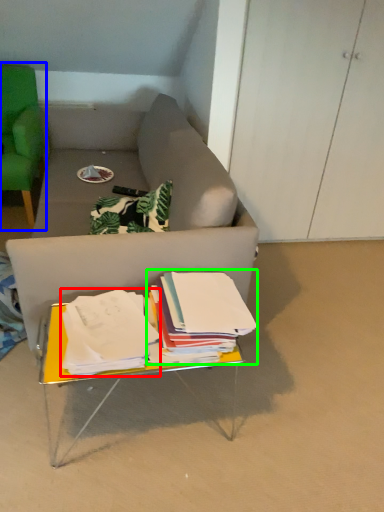
Question: Which object is the closest to the paperback book (highlighted by a red box)? Choose among these: chair (highlighted by a blue box) or paperback book (highlighted by a green box).

Choices:
 (A) chair
 (B) paperback book

Answer: (B)